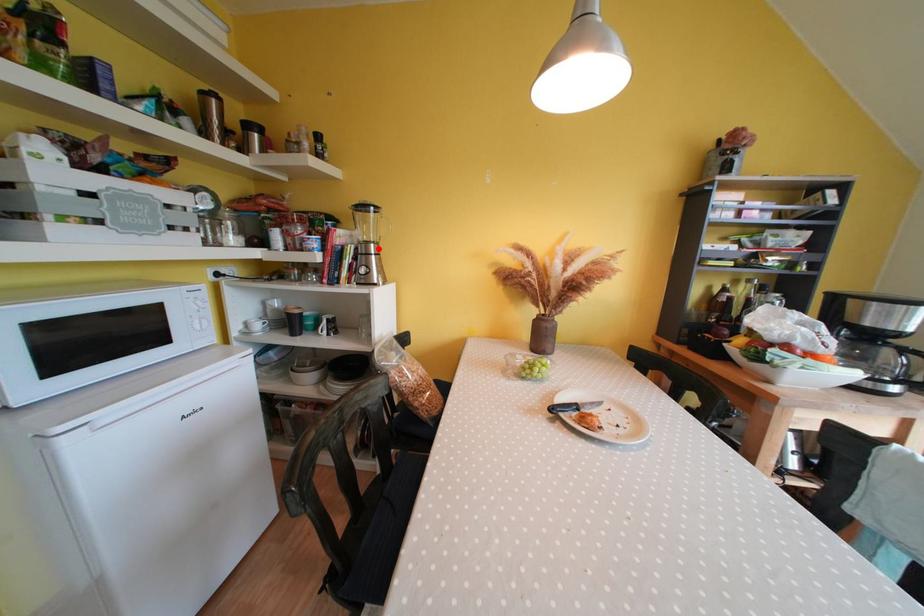
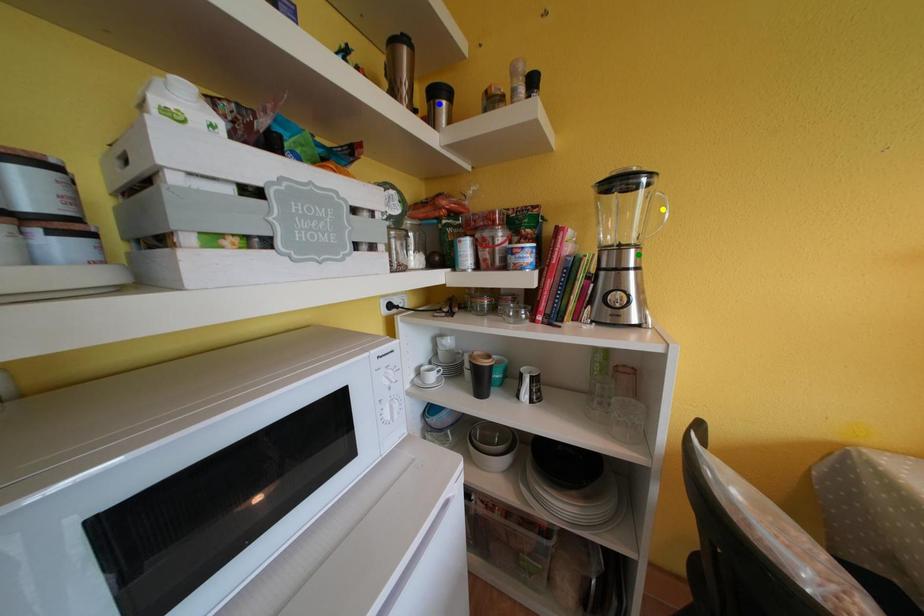
Question: I am providing you with two images of the same scene from different viewpoints. A red point is marked on the first image. You are given multiple points on the second image. Which point in image 2 represents the same 3d spot as the red point in image 1?

Choices:
 (A) green point
 (B) blue point
 (C) yellow point

Answer: (A)